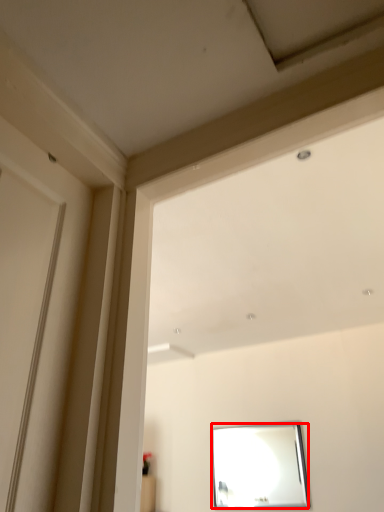
Question: In this image, where is mirror (annotated by the red box) located relative to window frame?

Choices:
 (A) right
 (B) left

Answer: (A)